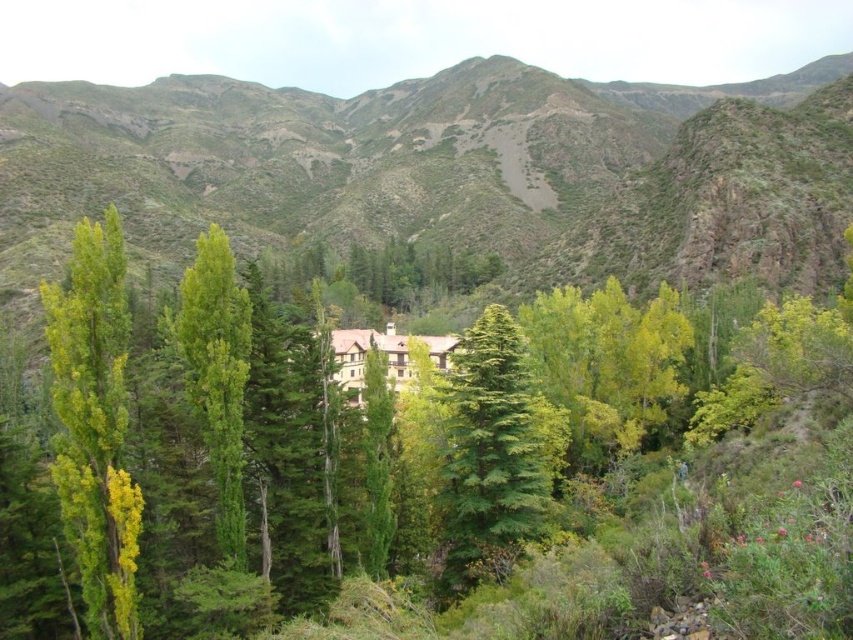
Question: Is green matte tree at center to the right of green textured tree at center from the viewer's perspective?

Choices:
 (A) no
 (B) yes

Answer: (A)

Question: Is yellow-green leafy tree at left smaller than green leafy tree at left?

Choices:
 (A) yes
 (B) no

Answer: (B)

Question: Which point appears farthest from the camera in this image?

Choices:
 (A) (517, 440)
 (B) (846, 380)

Answer: (B)

Question: Which of the following is the closest to the observer?

Choices:
 (A) green matte tree at center
 (B) green grassy mountain at center
 (C) yellow-green leafy tree at left

Answer: (A)

Question: Does green grassy mountain at center come in front of yellow-green leafy tree at left?

Choices:
 (A) yes
 (B) no

Answer: (B)

Question: Among these points, which one is farthest from the camera?

Choices:
 (A) (659, 316)
 (B) (225, 257)
 (C) (86, 627)
 (D) (283, 129)

Answer: (D)